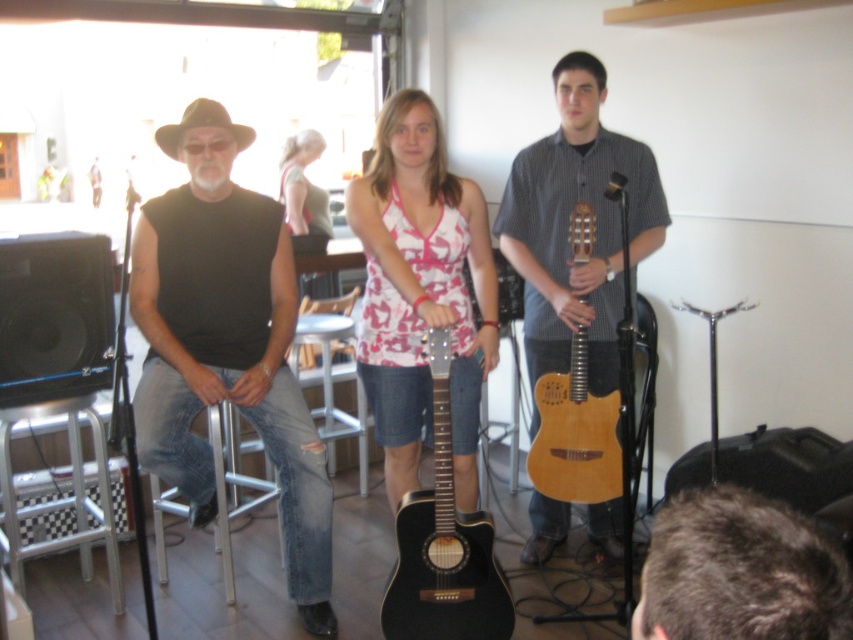
Question: Is matte pink halter top at center below metallic silver bar stool at lower left?

Choices:
 (A) yes
 (B) no

Answer: (B)

Question: Does wooden acoustic guitar at center lie in front of acoustic guitar at center?

Choices:
 (A) no
 (B) yes

Answer: (B)

Question: Which of these objects is positioned farthest from the matte wood guitar at center?

Choices:
 (A) silver metallic bar stool at lower left
 (B) acoustic guitar at center
 (C) natural wood acoustic guitar at center
 (D) dark brown hair at lower right

Answer: (D)

Question: Which point appears farthest from the camera in this image?

Choices:
 (A) (798, 595)
 (B) (534, 145)
 (C) (265, 477)
 (D) (424, 296)

Answer: (C)

Question: Is wooden acoustic guitar at center below matte black guitar at left?

Choices:
 (A) yes
 (B) no

Answer: (B)

Question: Which point is farther to the camera?

Choices:
 (A) (332, 381)
 (B) (445, 413)

Answer: (A)